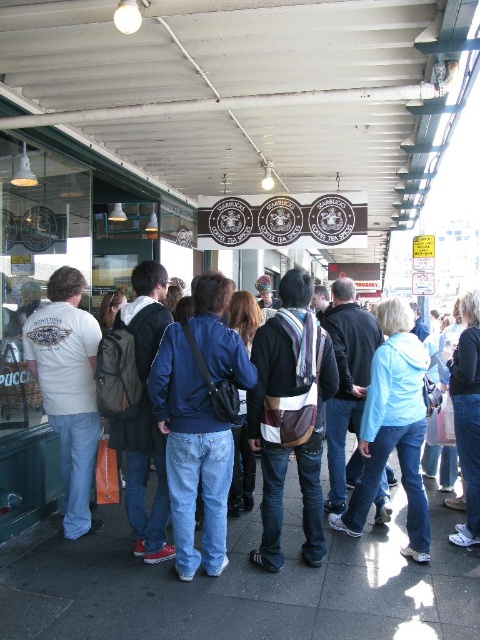
You are a photographer standing 2 meters away from the camera. You want to take a photo of the blue denim jeans at center. Can you reach the camera to take the photo without moving from your current position?

The blue denim jeans at center and camera are 3.44 meters apart. Since you are 2 meters away from the camera, you are 1.44 meters away from the blue denim jeans at center. Therefore, you can reach the camera to take the photo without moving.